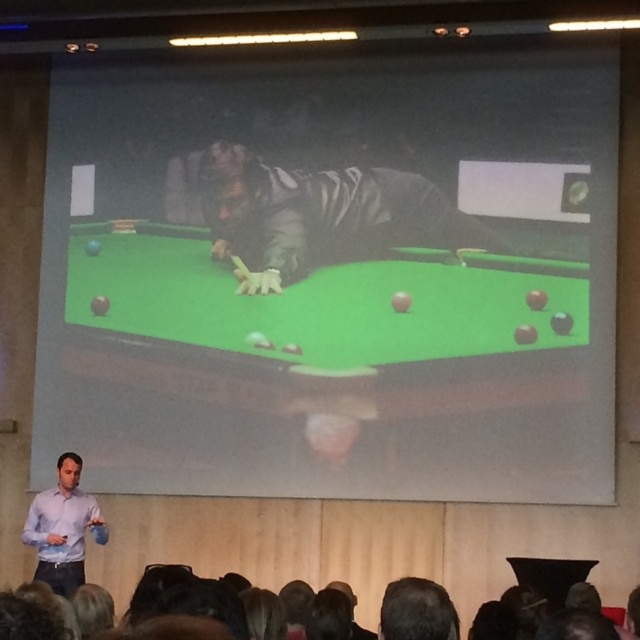
Question: Which point is closer to the camera taking this photo?

Choices:
 (A) (80, 500)
 (B) (156, 259)
 (C) (372, 184)

Answer: (A)

Question: Can you confirm if green felt billiard table at center is smaller than light purple shirt at lower left?

Choices:
 (A) no
 (B) yes

Answer: (A)

Question: Does dark matte jacket at center have a smaller size compared to light purple shirt at lower left?

Choices:
 (A) no
 (B) yes

Answer: (A)

Question: Is green felt billiard table at center bigger than dark matte jacket at center?

Choices:
 (A) yes
 (B) no

Answer: (A)

Question: Which point is farther from the camera taking this photo?

Choices:
 (A) (356, 180)
 (B) (70, 509)
 (C) (364, 355)

Answer: (A)

Question: Which of these objects is positioned farthest from the dark matte jacket at center?

Choices:
 (A) light purple shirt at lower left
 (B) green felt billiard table at center

Answer: (A)